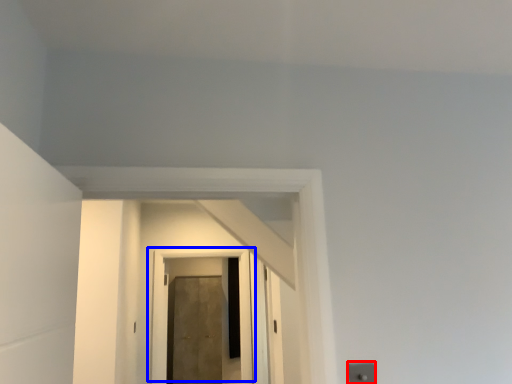
Question: Which point is closer to the camera, electric outlet (highlighted by a red box) or door (highlighted by a blue box)?

Choices:
 (A) electric outlet
 (B) door

Answer: (A)